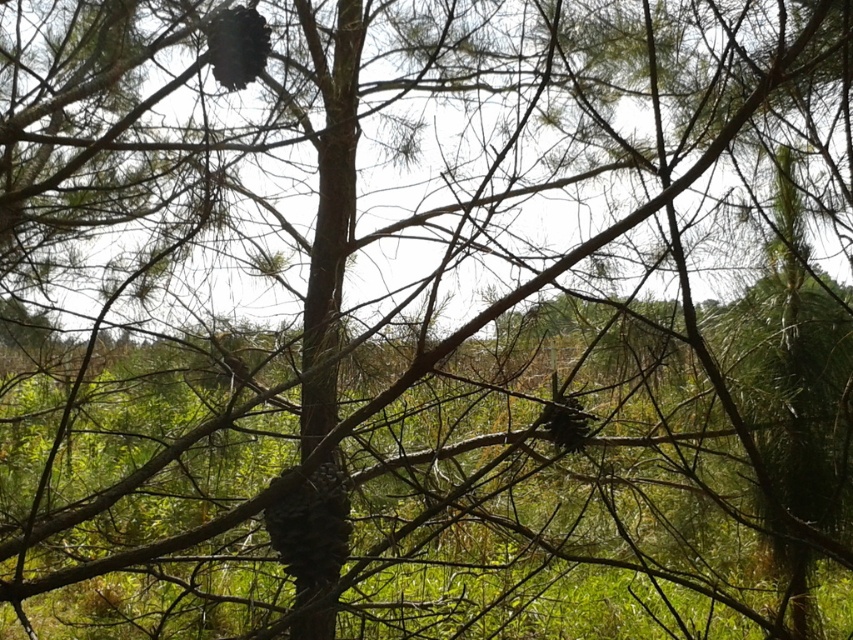
You are standing in front of the tree and want to pick up the brown rough pine cone at center. According to the coordinates provided, where should you look to find it?

The brown rough pine cone at center is located at point (311,531).

You are an ornithologist observing the tree from the ground. You notice two pine cones in the tree. One is the brown rough pine cone at center and the other is the dark brown textured pine cone at upper center. Which pine cone is closer to you?

The brown rough pine cone at center is closer to you because the dark brown textured pine cone at upper center is behind it.

You are standing in the outdoor scene with the pine tree. There is a point at coordinate (311, 531). What object is this point located on?

The point at coordinate (311, 531) is located on the brown rough pine cone at center.